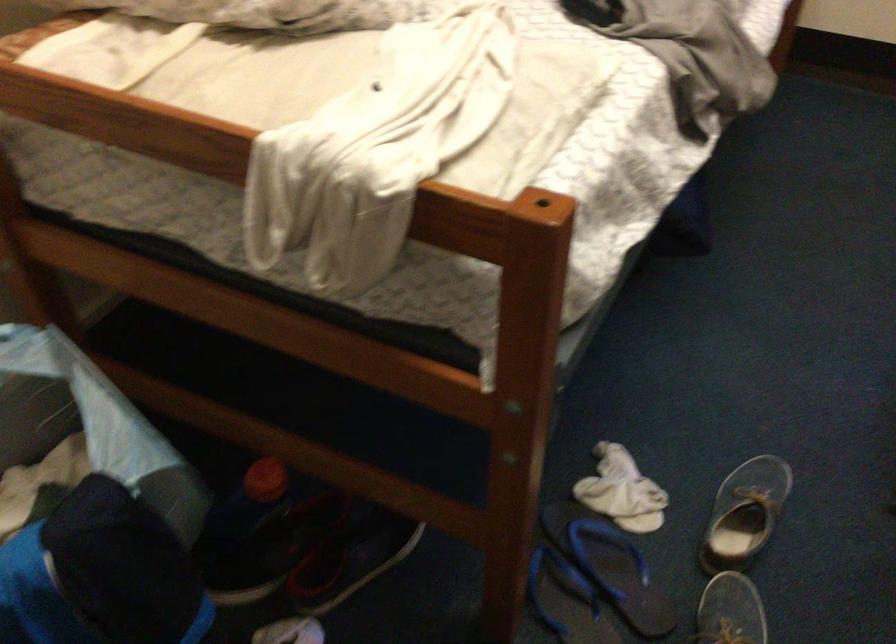
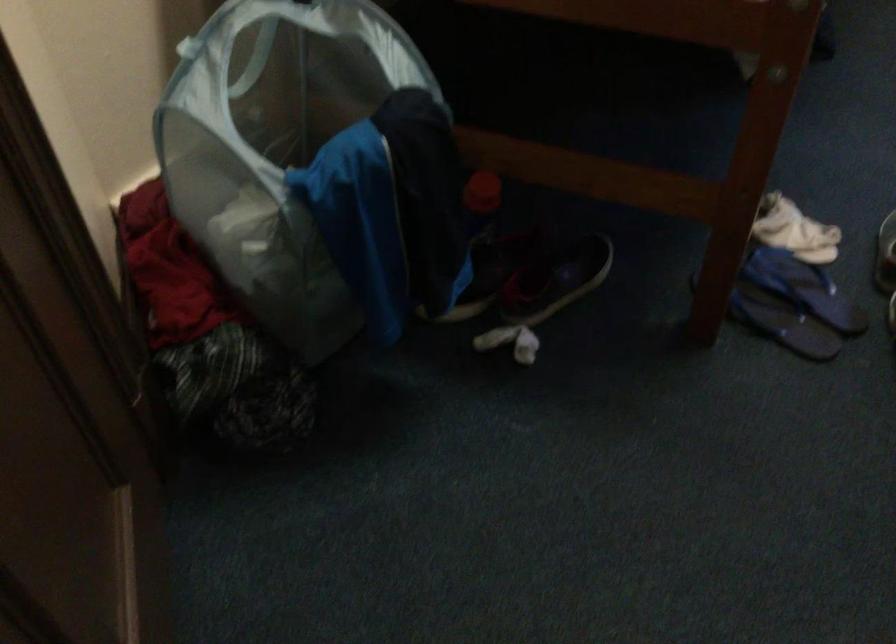
Question: The images are taken continuously from a first-person perspective. In which direction are you moving?

Choices:
 (A) Left
 (B) Right
 (C) Forward
 (D) Backward

Answer: (A)